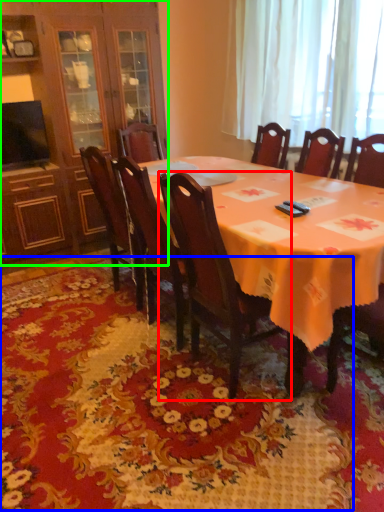
Question: Based on their relative distances, which object is nearer to chair (highlighted by a red box)? Choose from mat (highlighted by a blue box) and cabinetry (highlighted by a green box).

Choices:
 (A) mat
 (B) cabinetry

Answer: (A)